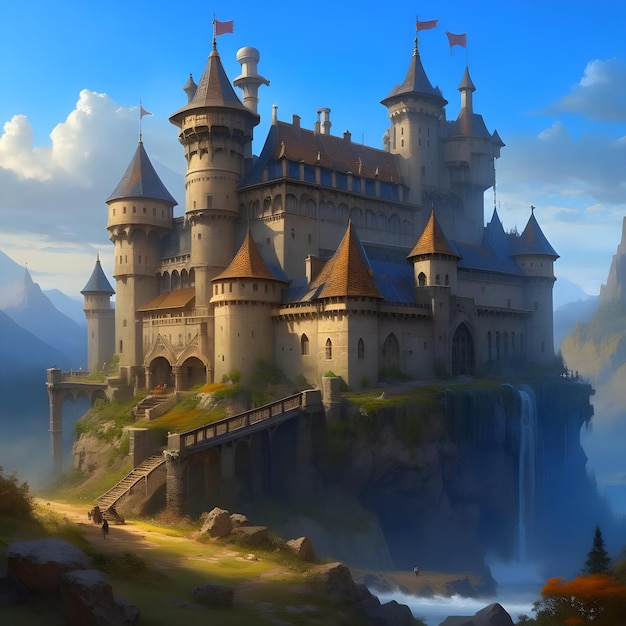
Find the location of a particular element. The image size is (626, 626). doors is located at coordinates (461, 345), (193, 376), (165, 375).